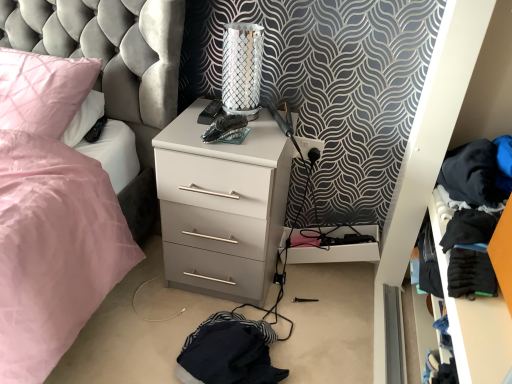
You are a GUI agent. You are given a task and a screenshot of the screen. Output one action in this format:
    pyautogui.click(x=<x>, y=<y>)
    Task: Click on the vacant area to the right of white matte chest of drawers at center
    
    Given the screenshot: What is the action you would take?
    pyautogui.click(x=314, y=304)